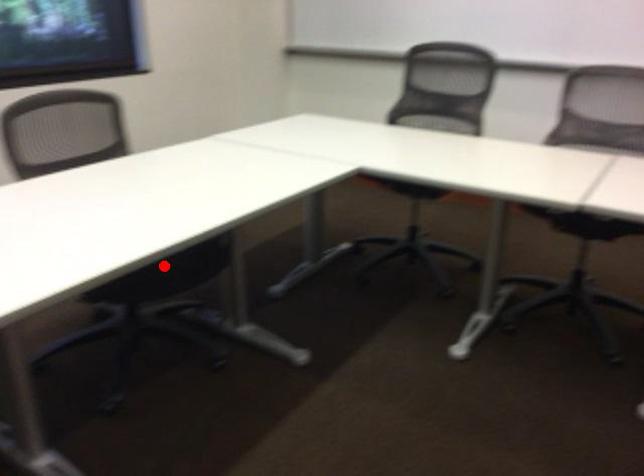
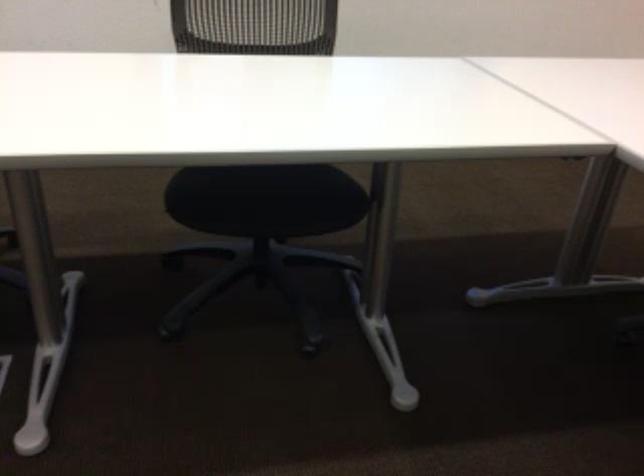
Question: A red point is marked in image1. In image2, is the corresponding 3D point closer to the camera or farther? Reply with the corresponding letter.

Choices:
 (A) The corresponding 3D point is closer.
 (B) The corresponding 3D point is farther.

Answer: (A)